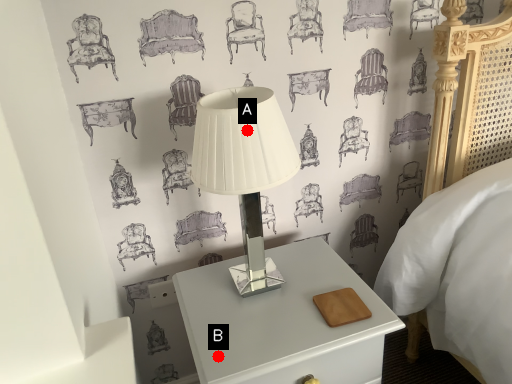
Question: Two points are circled on the image, labeled by A and B beside each circle. Which point is closer to the camera taking this photo?

Choices:
 (A) A is closer
 (B) B is closer

Answer: (A)